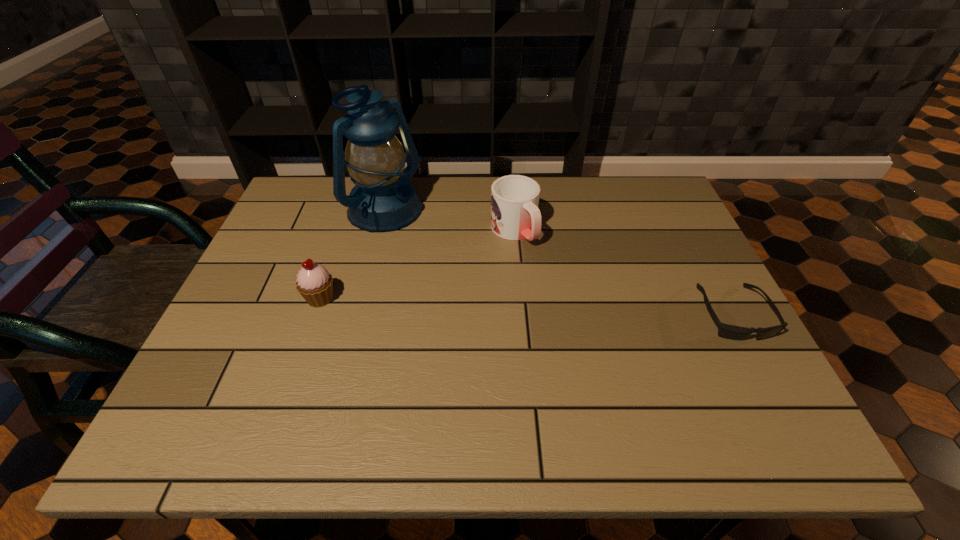
Where is `cupcake`? cupcake is located at coordinates (315, 284).

You are a GUI agent. You are given a task and a screenshot of the screen. Output one action in this format:
    pyautogui.click(x=<x>, y=<y>)
    Task: Click on the shortest object
    The height and width of the screenshot is (540, 960).
    Given the screenshot: What is the action you would take?
    pyautogui.click(x=726, y=331)

Where is `the rightmost object`? the rightmost object is located at coordinates (726, 331).

Identify the location of the tallest object. (383, 199).

Locate an element on the screen. the third object from left to right is located at coordinates (515, 215).

Identify the location of vacant space positioned 0.390m on the right of the cupcake. Image resolution: width=960 pixels, height=540 pixels. (502, 298).

At what (x,y) coordinates should I click in order to perform the action: click on free location located on the front-facing side of the shortest object. Please return your answer as a coordinate pair (x, y). Looking at the image, I should click on (765, 374).

Image resolution: width=960 pixels, height=540 pixels. I want to click on free space located 0.320m on the face of the lantern, so click(x=492, y=294).

The width and height of the screenshot is (960, 540). I want to click on free space located 0.220m on the face of the lantern, so click(463, 274).

Find the location of a particular element. free location located on the face of the lantern is located at coordinates (439, 257).